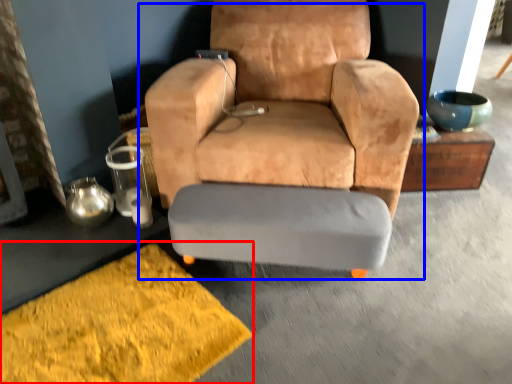
Question: Which object appears closest to the camera in this image, doormat (highlighted by a red box) or chair (highlighted by a blue box)?

Choices:
 (A) doormat
 (B) chair

Answer: (A)